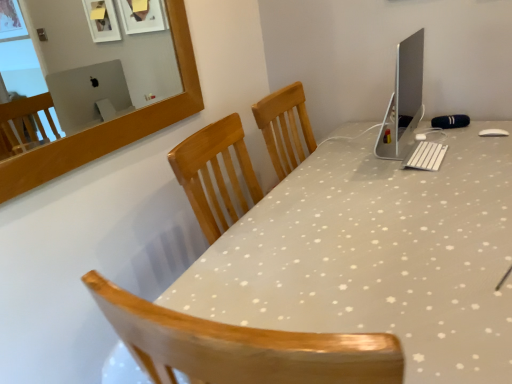
At what (x,y) coordinates should I click in order to perform the action: click on free spot in front of sleek silver monitor at upper right. Please return your answer as a coordinate pair (x, y). Looking at the image, I should click on [x=411, y=189].